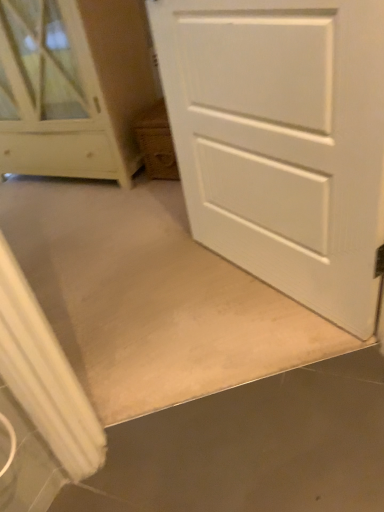
Question: Can you confirm if white matte door at center is taller than white wood chest of drawers at upper left?

Choices:
 (A) no
 (B) yes

Answer: (A)

Question: Is white matte door at center positioned in front of white wood chest of drawers at upper left?

Choices:
 (A) yes
 (B) no

Answer: (A)

Question: From a real-world perspective, is white matte door at center beneath white wood chest of drawers at upper left?

Choices:
 (A) no
 (B) yes

Answer: (B)

Question: Is white matte door at center looking in the opposite direction of white wood chest of drawers at upper left?

Choices:
 (A) yes
 (B) no

Answer: (B)

Question: From a real-world perspective, is white matte door at center over white wood chest of drawers at upper left?

Choices:
 (A) no
 (B) yes

Answer: (A)

Question: Does white matte door at center have a greater width compared to white wood chest of drawers at upper left?

Choices:
 (A) yes
 (B) no

Answer: (B)

Question: Is white wood chest of drawers at upper left positioned far away from white matte door at center?

Choices:
 (A) yes
 (B) no

Answer: (A)

Question: Is white matte door at center inside white wood chest of drawers at upper left?

Choices:
 (A) no
 (B) yes

Answer: (A)

Question: Could you tell me if white wood chest of drawers at upper left is facing white matte door at center?

Choices:
 (A) yes
 (B) no

Answer: (B)

Question: Is white wood chest of drawers at upper left shorter than white matte door at center?

Choices:
 (A) yes
 (B) no

Answer: (B)

Question: Is white wood chest of drawers at upper left outside white matte door at center?

Choices:
 (A) no
 (B) yes

Answer: (B)

Question: Is white wood chest of drawers at upper left touching white matte door at center?

Choices:
 (A) yes
 (B) no

Answer: (B)

Question: From the image's perspective, relative to white wood chest of drawers at upper left, is white matte door at center above or below?

Choices:
 (A) below
 (B) above

Answer: (A)